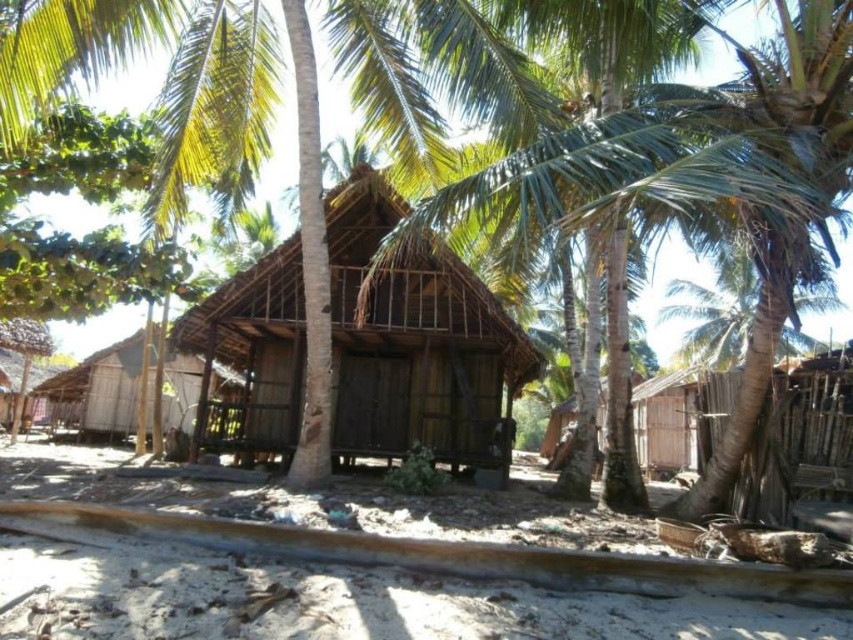
You are planning to build a new shed in your backyard and want to ensure it matches the size of the existing structures. You see the wooden thatched roof hut at center and the brown wooden hut at center in the image. Which one is smaller in size?

The wooden thatched roof hut at center is smaller compared to the brown wooden hut at center, so it would be the better reference for building a similarly sized shed.